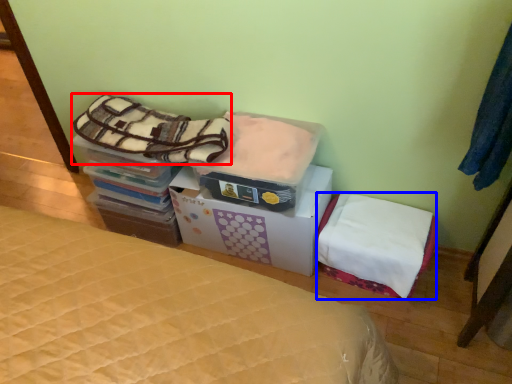
Question: Which of the following is the closest to the observer, blanket (highlighted by a red box) or mattress (highlighted by a blue box)?

Choices:
 (A) blanket
 (B) mattress

Answer: (A)